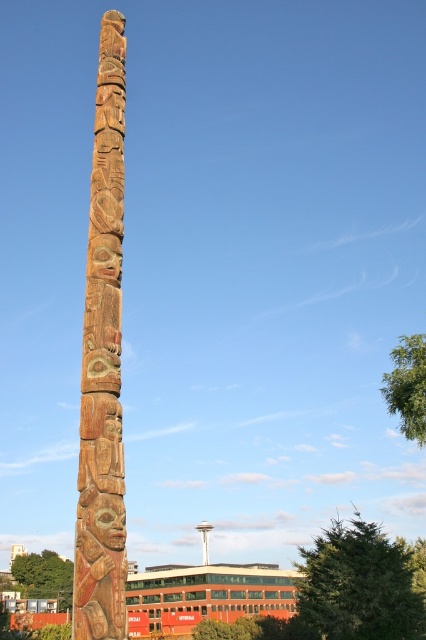
Is green textured tree at lower right closer to camera compared to green leafy tree at lower left?

Yes.

Which is more to the right, green textured tree at lower right or green leafy tree at lower left?

Positioned to the right is green textured tree at lower right.

Is point (383, 547) in front of point (57, 582)?

Yes, it is.

Where is `green textured tree at lower right`? green textured tree at lower right is located at coordinates (359, 584).

Based on the photo, which is below, green leafy tree at upper right or green leafy tree at lower left?

Positioned lower is green leafy tree at lower left.

Is point (394, 355) behind point (23, 586)?

No, (394, 355) is in front of (23, 586).

The width and height of the screenshot is (426, 640). Find the location of `green leafy tree at upper right`. green leafy tree at upper right is located at coordinates (408, 387).

Can you confirm if wooden totem pole at center is shorter than green leafy tree at lower left?

No.

Is point (94, 224) more distant than point (65, 577)?

That is False.

I want to click on wooden totem pole at center, so click(103, 365).